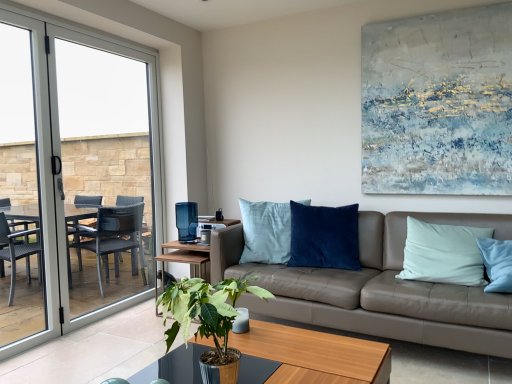
Question: Does point (227, 279) appear closer or farther from the camera than point (13, 122)?

Choices:
 (A) farther
 (B) closer

Answer: (B)

Question: Visually, is green leafy plant at center positioned to the left or to the right of clear glass door at left?

Choices:
 (A) left
 (B) right

Answer: (B)

Question: Which object is the closest to the clear glass screen door at left?

Choices:
 (A) clear glass door at left
 (B) clear glass table at center
 (C) textured canvas painting at upper right
 (D) green leafy plant at center
 (E) leather couch at center

Answer: (A)

Question: Estimate the real-world distances between objects in this image. Which object is farther from the textured canvas painting at upper right?

Choices:
 (A) green leafy plant at center
 (B) clear glass table at center
 (C) clear glass screen door at left
 (D) wooden coffee table at center
 (E) clear glass door at left

Answer: (C)